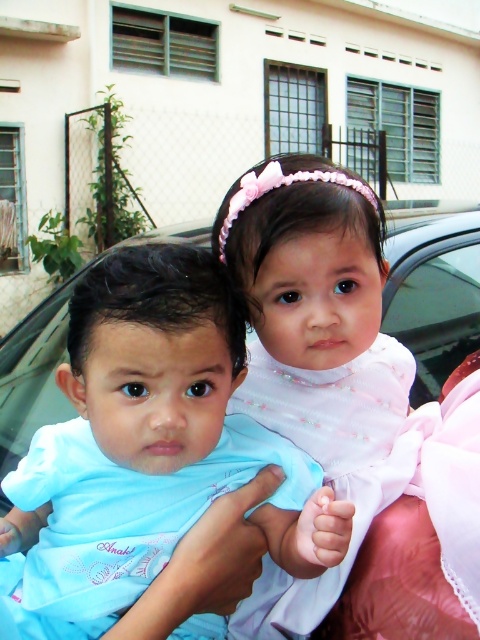
Question: Is light blue fabric baby at center below transparent glass car window at right?

Choices:
 (A) no
 (B) yes

Answer: (B)

Question: Can you confirm if light blue fabric baby at center is smaller than transparent glass car window at right?

Choices:
 (A) yes
 (B) no

Answer: (A)

Question: Which object is farther from the camera taking this photo?

Choices:
 (A) transparent glass car window at right
 (B) white satin dress at center
 (C) light blue fabric baby at center

Answer: (A)

Question: Among these objects, which one is farthest from the camera?

Choices:
 (A) white satin dress at center
 (B) transparent glass car window at right

Answer: (B)

Question: Can you confirm if light blue fabric baby at center is positioned to the left of transparent glass car window at right?

Choices:
 (A) yes
 (B) no

Answer: (A)

Question: Considering the real-world distances, which object is closest to the transparent glass car window at right?

Choices:
 (A) light blue fabric baby at center
 (B) white satin dress at center

Answer: (B)